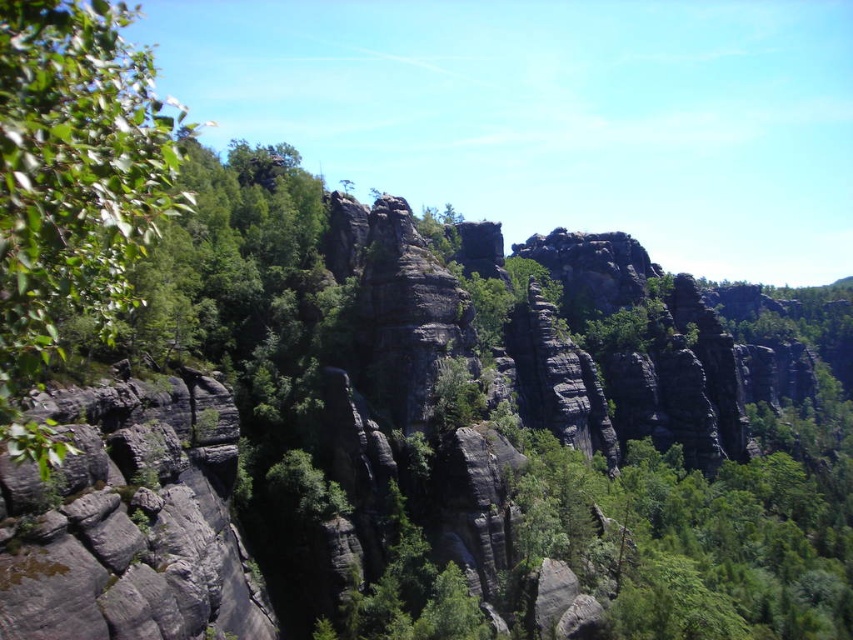
The image size is (853, 640). I want to click on green leafy tree at left, so click(73, 188).

Between point (64, 305) and point (225, 404), which one is positioned behind?

Positioned behind is point (225, 404).

At what (x,y) coordinates should I click in order to perform the action: click on green leafy tree at left. Please return your answer as a coordinate pair (x, y). Looking at the image, I should click on (73, 188).